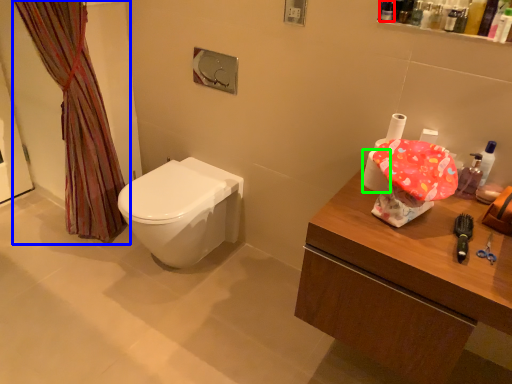
Question: Estimate the real-world distances between objects in this image. Which object is farther from toiletry (highlighted by a red box), curtain (highlighted by a blue box) or toilet paper (highlighted by a green box)?

Choices:
 (A) curtain
 (B) toilet paper

Answer: (A)